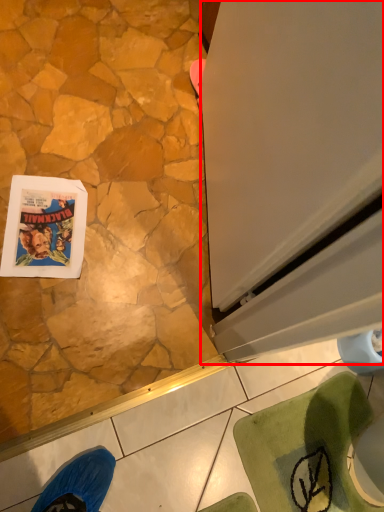
Question: From the image, what is the correct spatial relationship of screen door (annotated by the red box) in relation to comic book?

Choices:
 (A) left
 (B) right

Answer: (B)